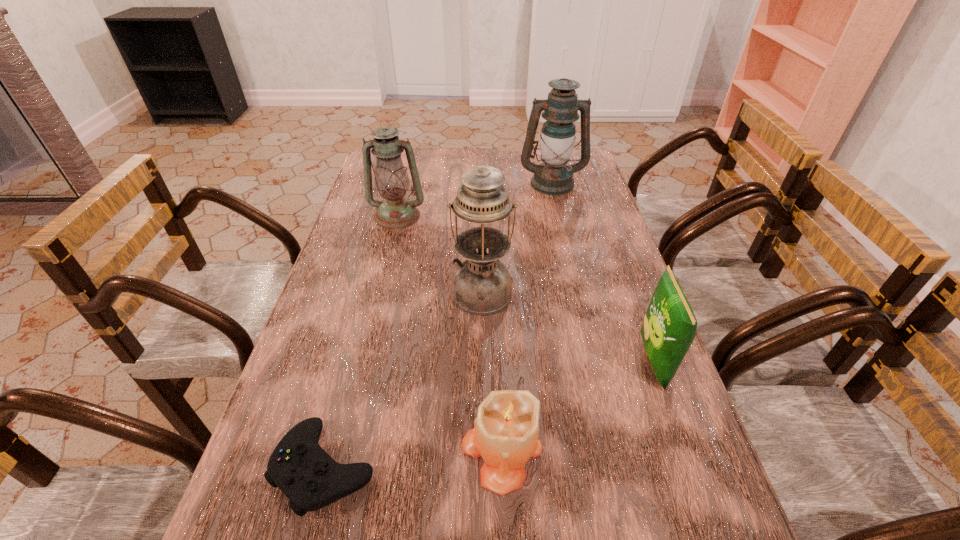
Where is `the rightmost oil lamp`? the rightmost oil lamp is located at coordinates (552, 177).

Locate an element on the screen. the farthest object is located at coordinates (552, 177).

This screenshot has height=540, width=960. In order to click on the second oil lamp from left to right in this screenshot , I will do `click(482, 285)`.

Where is `the nearest oil lamp`? The height and width of the screenshot is (540, 960). the nearest oil lamp is located at coordinates (482, 285).

This screenshot has height=540, width=960. In order to click on the second farthest oil lamp in this screenshot , I will do `click(395, 211)`.

Where is `the leftmost oil lamp`? This screenshot has height=540, width=960. the leftmost oil lamp is located at coordinates (395, 211).

You are a GUI agent. You are given a task and a screenshot of the screen. Output one action in this format:
    pyautogui.click(x=<x>, y=<y>)
    Task: Click on the third shortest object
    The width and height of the screenshot is (960, 540).
    Given the screenshot: What is the action you would take?
    pyautogui.click(x=669, y=327)

At what (x,y) coordinates should I click in order to perform the action: click on the fourth farthest object. Please return your answer as a coordinate pair (x, y). Looking at the image, I should click on (669, 327).

Locate an element on the screen. The height and width of the screenshot is (540, 960). candle is located at coordinates (505, 434).

The image size is (960, 540). I want to click on the shortest object, so click(x=310, y=478).